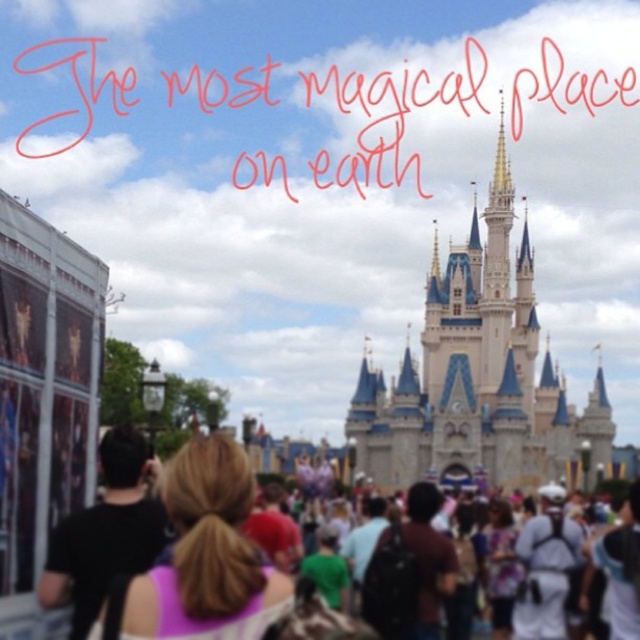
Question: Which point is closer to the camera?

Choices:
 (A) (476, 324)
 (B) (177, 605)
 (C) (372, 444)

Answer: (B)

Question: Can you confirm if white stone castle at center is smaller than blonde hair at center?

Choices:
 (A) no
 (B) yes

Answer: (A)

Question: Does white stone castle at center appear over blonde hair at center?

Choices:
 (A) no
 (B) yes

Answer: (B)

Question: Can you confirm if blurred people at center is wider than blonde hair at center?

Choices:
 (A) no
 (B) yes

Answer: (B)

Question: Based on their relative distances, which object is nearer to the blurred people at center?

Choices:
 (A) blonde hair at center
 (B) white stone castle at center

Answer: (B)

Question: Which point is farther from the camera taking this photo?

Choices:
 (A) (180, 472)
 (B) (547, 429)
 (C) (396, 406)

Answer: (B)